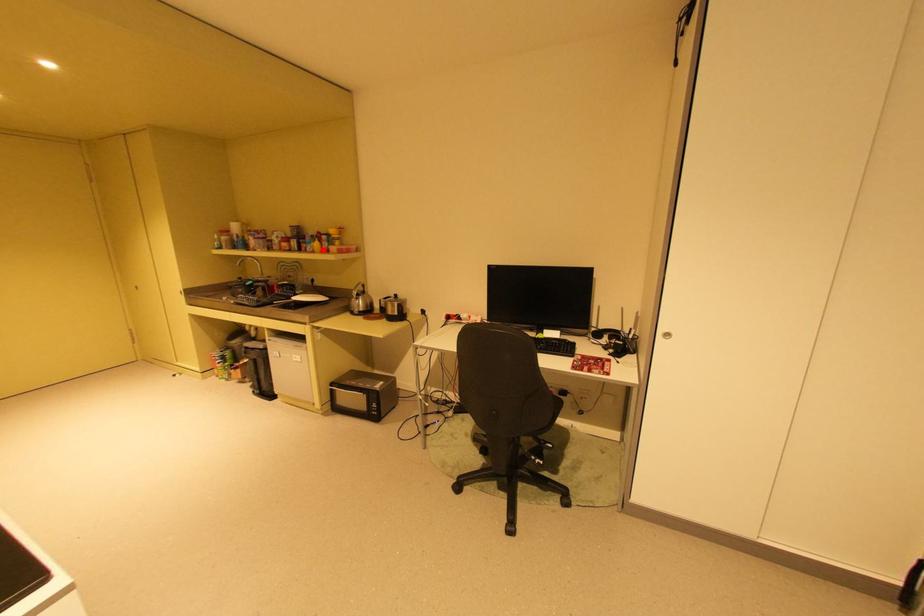
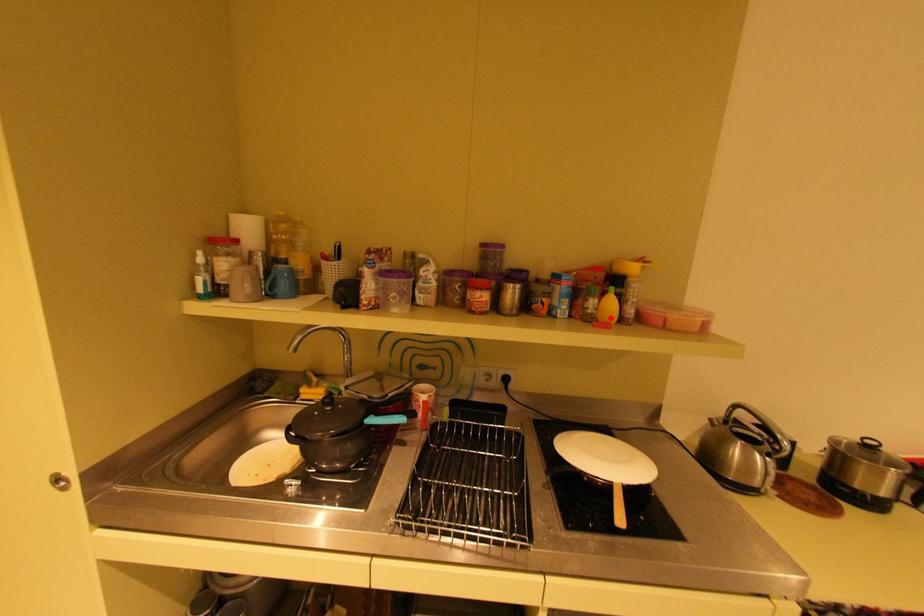
I am providing you with two images of the same scene from different viewpoints. A red point is marked on the first image and another point is marked on the second image. Is the marked point in image1 the same physical position as the marked point in image2?

Yes